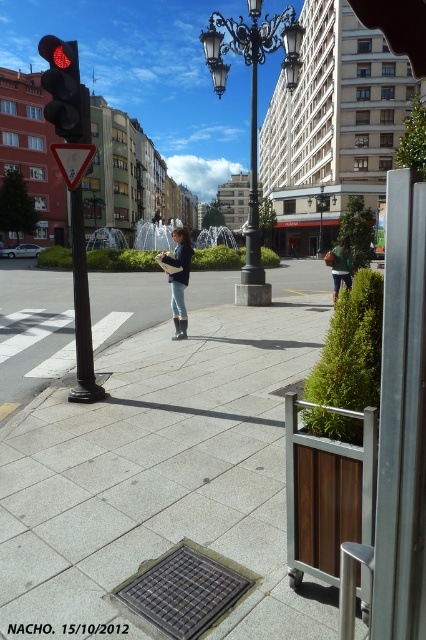
Question: Is black wrought iron streetlight at center wider than black glass lamp post at center?

Choices:
 (A) no
 (B) yes

Answer: (B)

Question: Among these objects, which one is farthest from the camera?

Choices:
 (A) gray concrete sidewalk at center
 (B) green fabric jacket at center

Answer: (B)

Question: Observing the image, what is the correct spatial positioning of red matte traffic light at left in reference to black glass lamp post at center?

Choices:
 (A) below
 (B) above

Answer: (B)

Question: Which point is farther from the camera taking this photo?

Choices:
 (A) (172, 266)
 (B) (46, 115)
 (C) (31, 444)
 (D) (324, 186)

Answer: (D)

Question: Which of these objects is positioned closest to the green fabric jacket at center?

Choices:
 (A) black glass lamp post at center
 (B) black wrought iron streetlight at center
 (C) denim jacket at center

Answer: (C)

Question: Does gray concrete sidewalk at center appear on the right side of red matte traffic light at left?

Choices:
 (A) yes
 (B) no

Answer: (A)